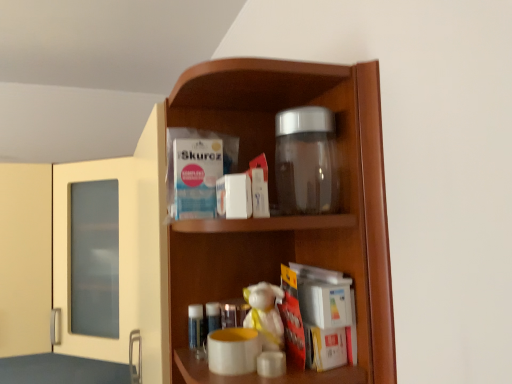
Question: Is point (130, 221) positioned closer to the camera than point (272, 306)?

Choices:
 (A) farther
 (B) closer

Answer: (A)

Question: Looking at their shapes, would you say transparent glass jar at upper center is wider or thinner than white plush toy at center?

Choices:
 (A) wide
 (B) thin

Answer: (A)

Question: Based on their relative distances, which object is farther from the transparent glass jar at upper center?

Choices:
 (A) white plush toy at center
 (B) transparent glass jar at upper center

Answer: (A)

Question: Which object is positioned farthest from the transparent glass jar at upper center?

Choices:
 (A) transparent glass jar at upper center
 (B) white plush toy at center

Answer: (B)